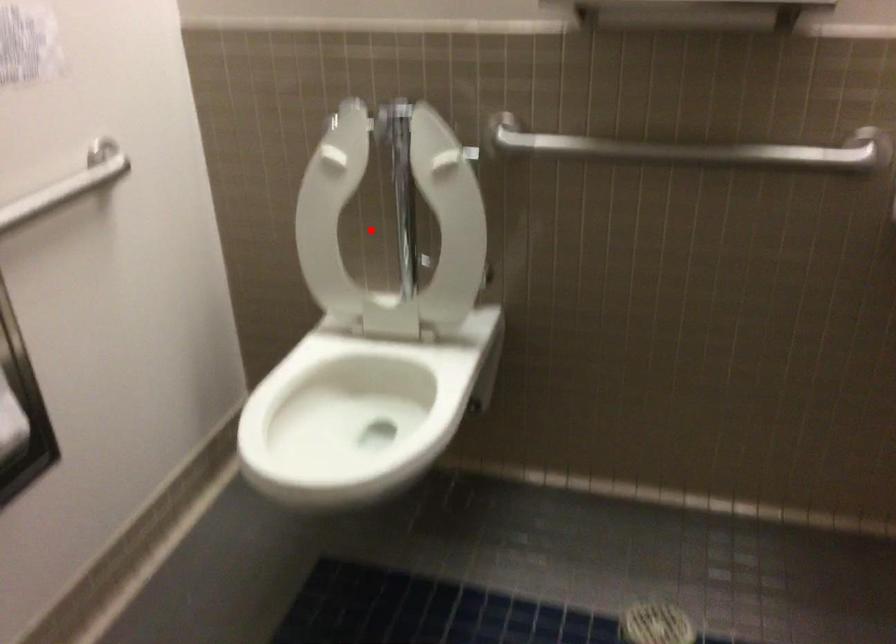
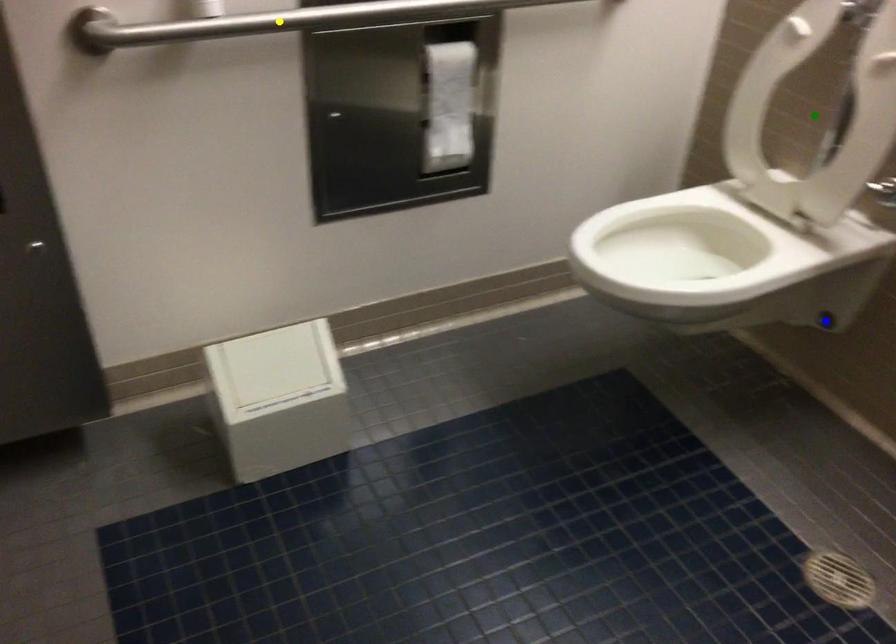
Question: I am providing you with two images of the same scene from different viewpoints. A red point is marked on the first image. You are given multiple points on the second image. Which point in image 2 is actually the same real-world point as the red point in image 1?

Choices:
 (A) blue point
 (B) green point
 (C) yellow point

Answer: (B)